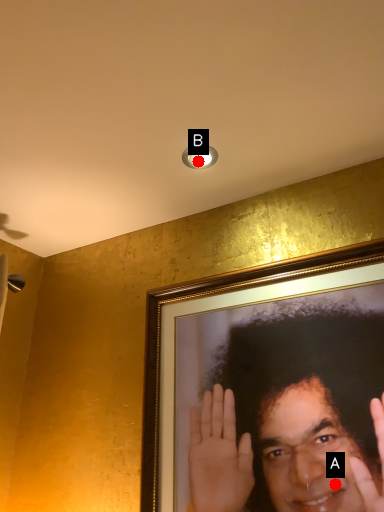
Question: Two points are circled on the image, labeled by A and B beside each circle. Which point is farther from the camera taking this photo?

Choices:
 (A) A is further
 (B) B is further

Answer: (B)